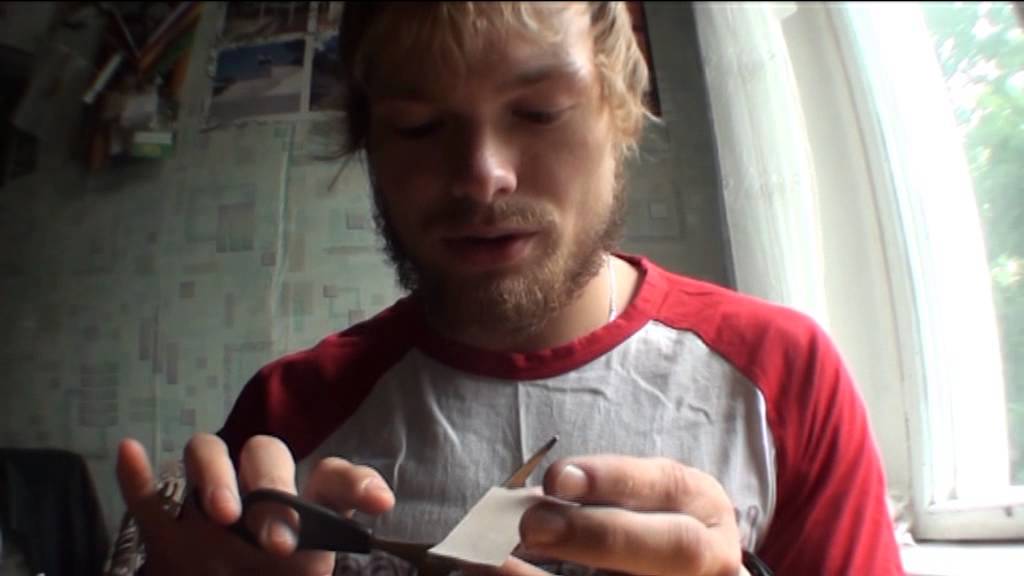
The image size is (1024, 576). I want to click on window, so (987, 210).